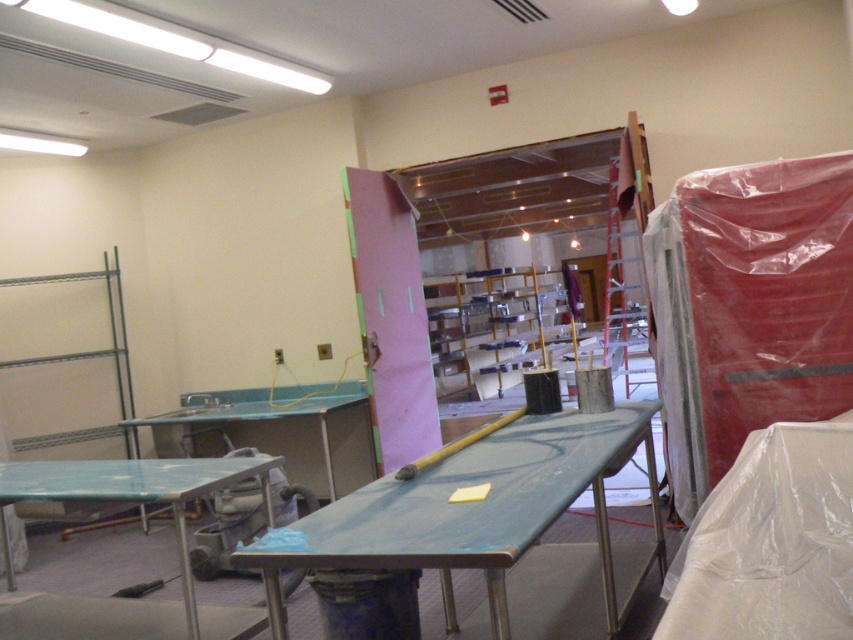
You are a contractor working in a construction area. You need to place a large equipment box that requires a table with the most surface area. Which table should you choose between the blue laminate table at lower left and the metallic blue table at center?

The metallic blue table at center has a larger surface area than the blue laminate table at lower left, so you should choose the metallic blue table at center for placing the large equipment box.

You are a contractor working in this utility area and need to place a heavy tool box on the highest available surface. Which table should you choose between the green matte table at center and the blue laminate table at lower left?

The green matte table at center has a greater height compared to the blue laminate table at lower left, so you should place the heavy tool box on the green matte table at center.